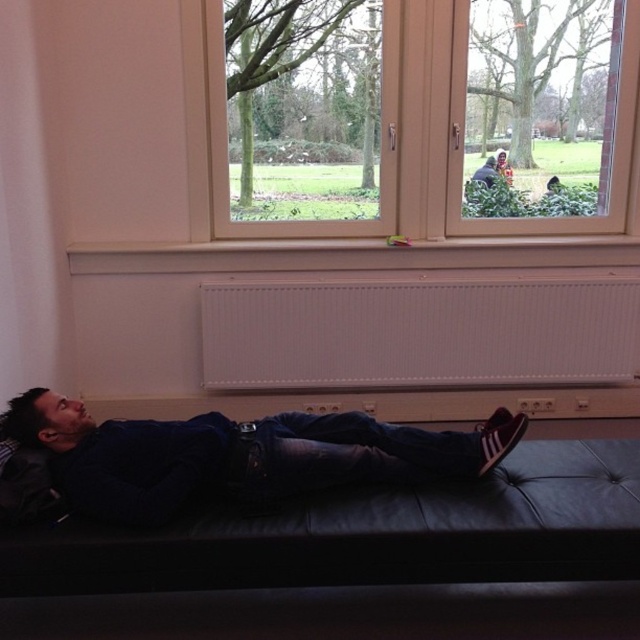
You are a delivery robot with a package that is 1.5 meters long. You need to place the package between the black leather couch at lower center and the wooden frame window at upper center. Is there enough space to fit the package horizontally?

The distance between the black leather couch at lower center and the wooden frame window at upper center is 1.62 meters. Since the package is 1.5 meters long, it should fit horizontally with some space to spare.